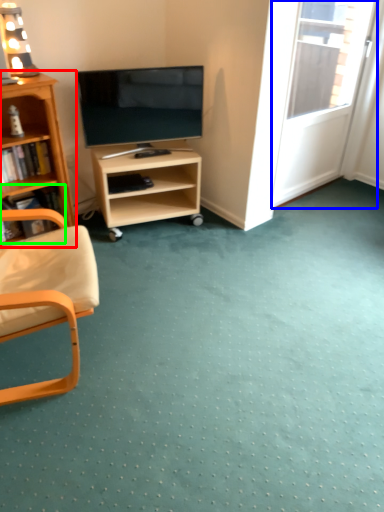
Question: Which object is positioned farthest from bookcase (highlighted by a red box)? Select from screen door (highlighted by a blue box) and book (highlighted by a green box).

Choices:
 (A) screen door
 (B) book

Answer: (A)